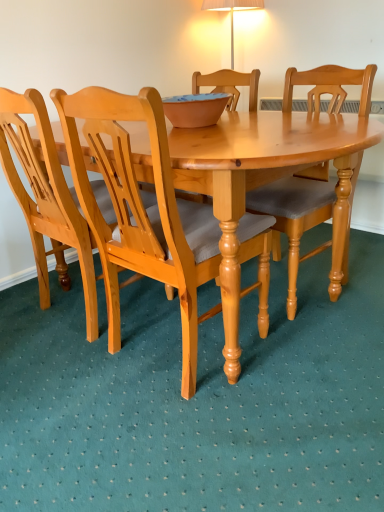
At what (x,y) coordinates should I click in order to perform the action: click on vacant region in front of light brown wood chair at left, the first chair in the left-to-right sequence. Please return your answer as a coordinate pair (x, y). Looking at the image, I should click on (72, 381).